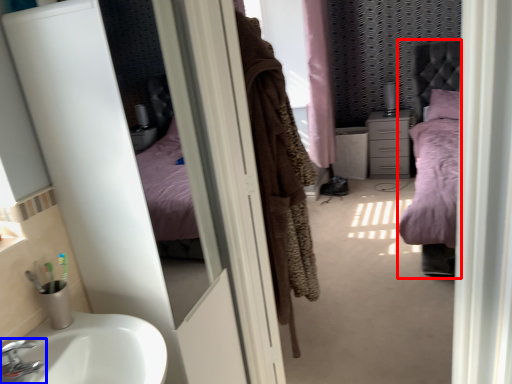
Question: Among these objects, which one is farthest to the camera, bed (highlighted by a red box) or tap (highlighted by a blue box)?

Choices:
 (A) bed
 (B) tap

Answer: (A)